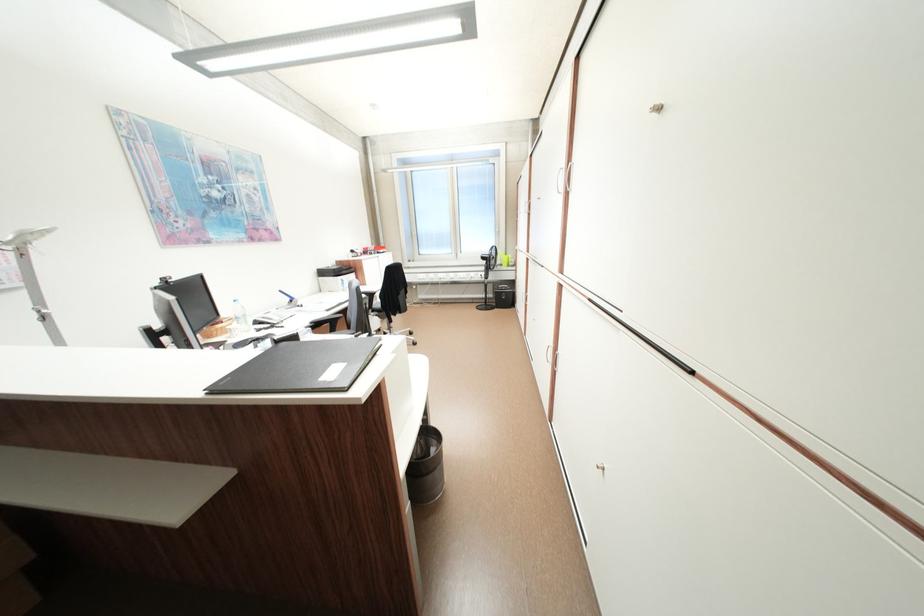
Where would you push the chair armrest? Please return your answer as a coordinate pair (x, y).

(371, 286)